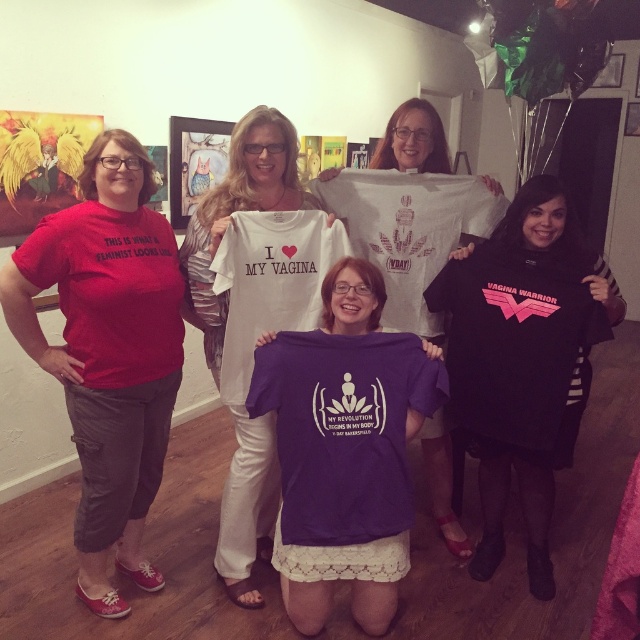
From the picture: Between white cotton shirt at center and purple fabric t-shirt at center, which one has less height?

purple fabric t-shirt at center is shorter.

Which is in front, point (225, 484) or point (396, 140)?

Point (225, 484) is in front.

The height and width of the screenshot is (640, 640). In order to click on white cotton shirt at center in this screenshot , I will do [237, 209].

Looking at this image, is matte red t-shirt at left in front of purple fabric t-shirt at center?

Yes.

This screenshot has width=640, height=640. What do you see at coordinates (108, 352) in the screenshot? I see `matte red t-shirt at left` at bounding box center [108, 352].

Image resolution: width=640 pixels, height=640 pixels. Find the location of `matte red t-shirt at left`. matte red t-shirt at left is located at coordinates (x=108, y=352).

Is the position of matte red t-shirt at left more distant than that of white cotton shirt at center?

No, it is in front of white cotton shirt at center.

Does point (29, 266) come behind point (216, 564)?

No, (29, 266) is in front of (216, 564).

Where is `matte red t-shirt at left`? This screenshot has width=640, height=640. matte red t-shirt at left is located at coordinates (108, 352).